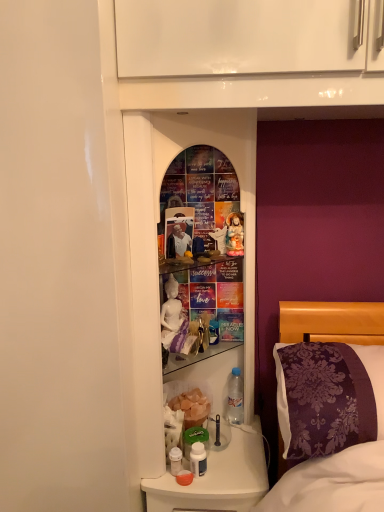
Find the location of `vacant point to the right of white plastic bottle at lower center, the 1th bottle when ordered from front to back`. vacant point to the right of white plastic bottle at lower center, the 1th bottle when ordered from front to back is located at coordinates (233, 476).